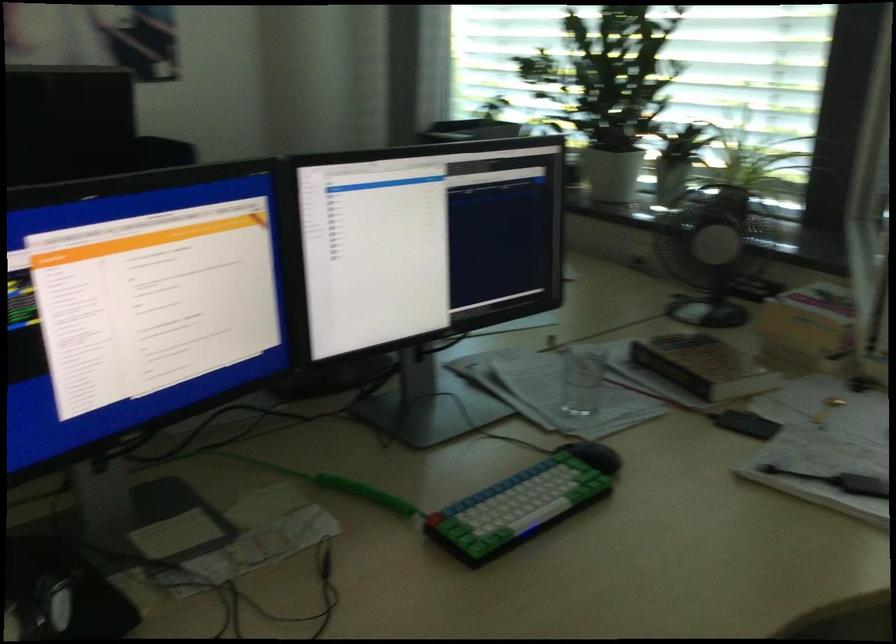
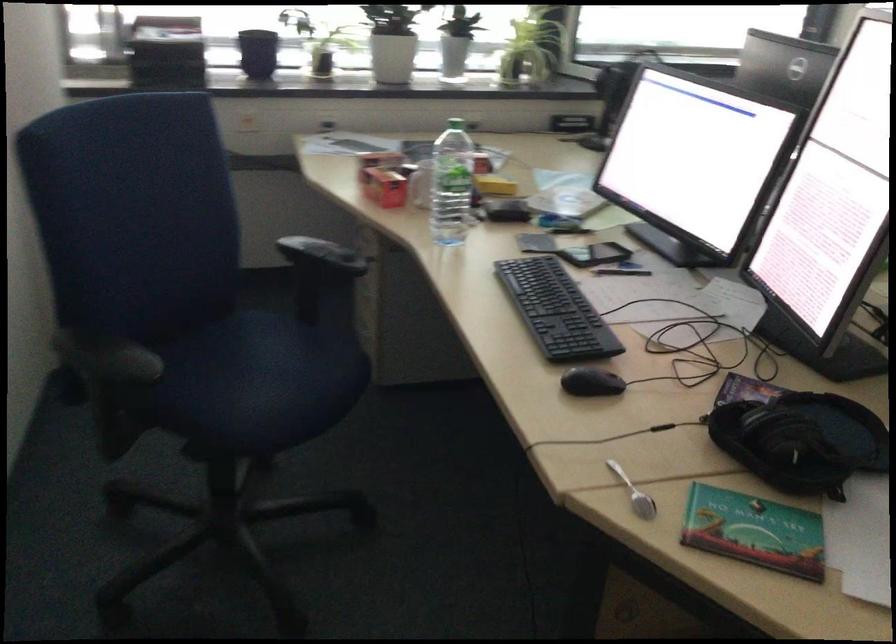
Question: I am providing you with two images of the same scene from different viewpoints. After the viewpoint changes to image2, which objects are now occluded?

Choices:
 (A) small colorful book
 (B) green bottle cap
 (C) open suitcase lid
 (D) small cardboard box

Answer: (D)